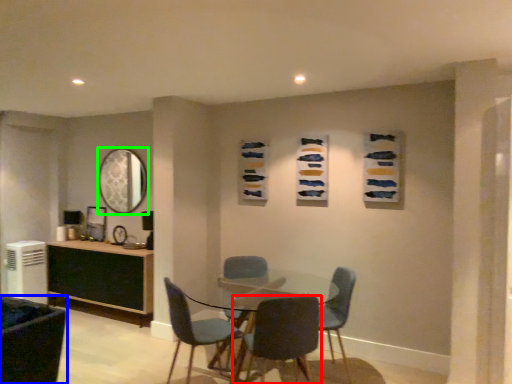
Question: Which object is the farthest from chair (highlighted by a red box)? Choose among these: chair (highlighted by a blue box) or mirror (highlighted by a green box).

Choices:
 (A) chair
 (B) mirror

Answer: (B)